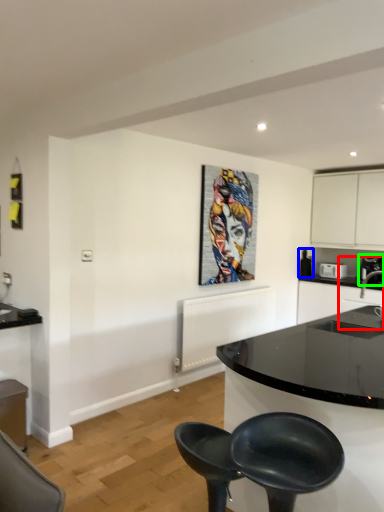
Question: Based on their relative distances, which object is nearer to sink (highlighted by a red box)? Choose from appliance (highlighted by a blue box) and coffee machine (highlighted by a green box).

Choices:
 (A) appliance
 (B) coffee machine

Answer: (B)